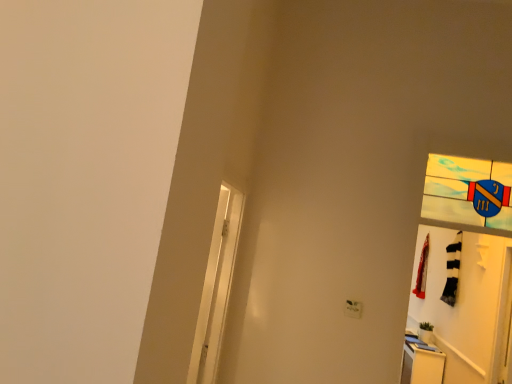
Describe the element at coordinates (462, 301) in the screenshot. I see `white matte door at right` at that location.

Where is `stained glass shield at upper right`? stained glass shield at upper right is located at coordinates (469, 193).

Locate an element on the screen. white glossy screen door at left is located at coordinates click(x=216, y=287).

From a real-world perspective, relative to stained glass shield at upper right, is white matte door at right vertically above or below?

In terms of real-world spatial position, white matte door at right is below stained glass shield at upper right.

Is white matte door at right wider than stained glass shield at upper right?

Incorrect, the width of white matte door at right does not surpass that of stained glass shield at upper right.

Is stained glass shield at upper right surrounded by white matte door at right?

Definitely not — stained glass shield at upper right is not inside white matte door at right.

Could you tell me if white matte door at right is turned towards stained glass shield at upper right?

No, white matte door at right is not aimed at stained glass shield at upper right.

Is white glossy dresser at lower right directly adjacent to red fabric laundry at right?

No.

Considering the sizes of objects white glossy dresser at lower right and red fabric laundry at right in the image provided, who is taller, white glossy dresser at lower right or red fabric laundry at right?

With more height is red fabric laundry at right.

Locate an element on the screen. This screenshot has width=512, height=384. laundry that is on the right side of white glossy dresser at lower right is located at coordinates (422, 271).

From the picture: Which object is more forward, white glossy dresser at lower right or red fabric laundry at right?

white glossy dresser at lower right is closer to the camera.

From the picture: Considering the relative sizes of white plastic electric outlet at lower right and red fabric laundry at right in the image provided, is white plastic electric outlet at lower right shorter than red fabric laundry at right?

Yes, white plastic electric outlet at lower right is shorter than red fabric laundry at right.

From the image's perspective, is white plastic electric outlet at lower right on red fabric laundry at right?

Indeed, from the image's perspective, white plastic electric outlet at lower right is shown above red fabric laundry at right.

Based on their positions, is white plastic electric outlet at lower right located to the left or right of red fabric laundry at right?

Clearly, white plastic electric outlet at lower right is on the left of red fabric laundry at right in the image.

Between stained glass shield at upper right and white glossy screen door at left, which one has smaller size?

stained glass shield at upper right is smaller.

Find the location of a particular element. This screenshot has height=384, width=512. screen door below the stained glass shield at upper right (from a real-world perspective) is located at coordinates (216, 287).

From a real-world perspective, which is physically above, stained glass shield at upper right or white glossy screen door at left?

From a 3D spatial view, stained glass shield at upper right is above.

Is stained glass shield at upper right facing towards white glossy screen door at left?

No, stained glass shield at upper right does not turn towards white glossy screen door at left.

What's the angular difference between red fabric laundry at right and white matte door at right's facing directions?

They differ by 93.5 degrees in their facing directions.

Between red fabric laundry at right and white matte door at right, which one has more height?

red fabric laundry at right is taller.

Between point (425, 249) and point (463, 330), which one is positioned behind?

The point (425, 249) is farther from the camera.

Which is correct: red fabric laundry at right is inside white matte door at right, or outside of it?

red fabric laundry at right is not inside white matte door at right, it's outside.

Is white glossy dresser at lower right closer to camera compared to white plastic electric outlet at lower right?

No, it is not.

From a real-world perspective, relative to white plastic electric outlet at lower right, is white glossy dresser at lower right vertically above or below?

Clearly, from a real-world perspective, white glossy dresser at lower right is below white plastic electric outlet at lower right.

Is white glossy dresser at lower right beside white plastic electric outlet at lower right?

No, white glossy dresser at lower right is not touching white plastic electric outlet at lower right.

From the picture: Considering the sizes of white glossy dresser at lower right and white plastic electric outlet at lower right in the image, is white glossy dresser at lower right taller or shorter than white plastic electric outlet at lower right?

Clearly, white glossy dresser at lower right is taller compared to white plastic electric outlet at lower right.

Would you say white glossy screen door at left is inside or outside white plastic electric outlet at lower right?

The correct answer is: outside.

Between white glossy screen door at left and white plastic electric outlet at lower right, which one has larger width?

Wider between the two is white glossy screen door at left.

Is white glossy screen door at left with white plastic electric outlet at lower right?

No.

Is the position of white glossy screen door at left more distant than that of white plastic electric outlet at lower right?

No.

There is a white matte door at right. Identify the location of glass window above it (from a real-world perspective). (469, 193).

You are a GUI agent. You are given a task and a screenshot of the screen. Output one action in this format:
    pyautogui.click(x=<x>, y=<y>)
    Task: Click on the dresser below the red fabric laundry at right (from the image's perspective)
    Image resolution: width=512 pixels, height=384 pixels.
    Given the screenshot: What is the action you would take?
    pyautogui.click(x=421, y=363)

Estimate the real-world distances between objects in this image. Which object is further from red fabric laundry at right, white matte door at right or white glossy screen door at left?

white glossy screen door at left is positioned further to the anchor red fabric laundry at right.

When comparing their distances from white glossy dresser at lower right, does white matte door at right or red fabric laundry at right seem closer?

Among the two, white matte door at right is located nearer to white glossy dresser at lower right.

Based on their spatial positions, is white glossy screen door at left or white matte door at right closer to stained glass shield at upper right?

white glossy screen door at left is positioned closer to the anchor stained glass shield at upper right.

Based on their spatial positions, is stained glass shield at upper right or white plastic electric outlet at lower right further from white matte door at right?

white plastic electric outlet at lower right is further to white matte door at right.

When comparing their distances from white glossy dresser at lower right, does stained glass shield at upper right or white glossy screen door at left seem further?

white glossy screen door at left is positioned further to the anchor white glossy dresser at lower right.

From the picture: When comparing their distances from white glossy dresser at lower right, does red fabric laundry at right or stained glass shield at upper right seem further?

The object further to white glossy dresser at lower right is stained glass shield at upper right.

When comparing their distances from red fabric laundry at right, does stained glass shield at upper right or white glossy dresser at lower right seem closer?

white glossy dresser at lower right lies closer to red fabric laundry at right than the other object.

Based on their spatial positions, is stained glass shield at upper right or white matte door at right further from red fabric laundry at right?

stained glass shield at upper right.

Where is `door between stained glass shield at upper right and white plastic electric outlet at lower right from top to bottom`? door between stained glass shield at upper right and white plastic electric outlet at lower right from top to bottom is located at coordinates (462, 301).

I want to click on electric outlet between white glossy screen door at left and stained glass shield at upper right from left to right, so click(x=353, y=309).

The image size is (512, 384). I want to click on electric outlet between white glossy screen door at left and white glossy dresser at lower right in the front-back direction, so click(x=353, y=309).

Where is `glass window located between white matte door at right and white glossy dresser at lower right in the depth direction`? This screenshot has width=512, height=384. glass window located between white matte door at right and white glossy dresser at lower right in the depth direction is located at coordinates (469, 193).